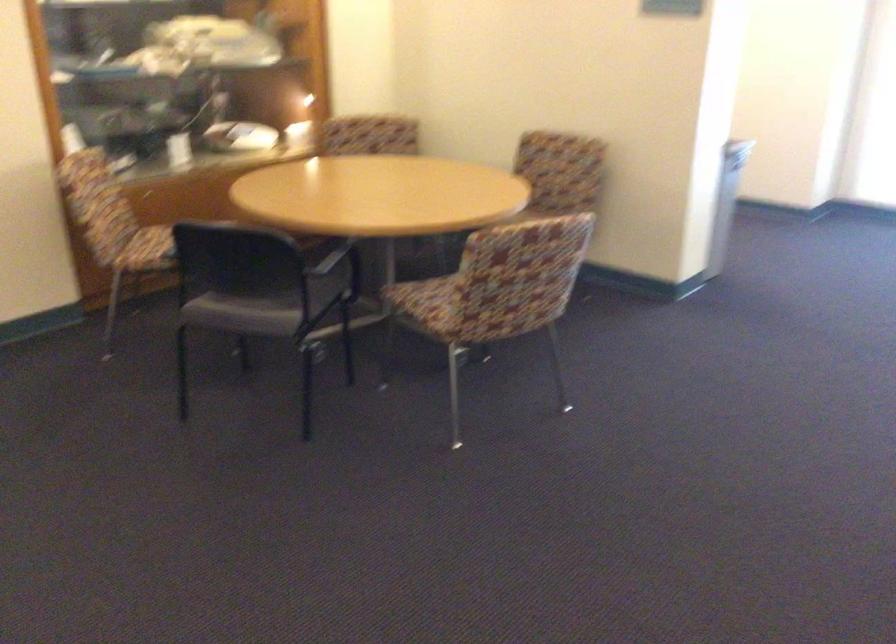
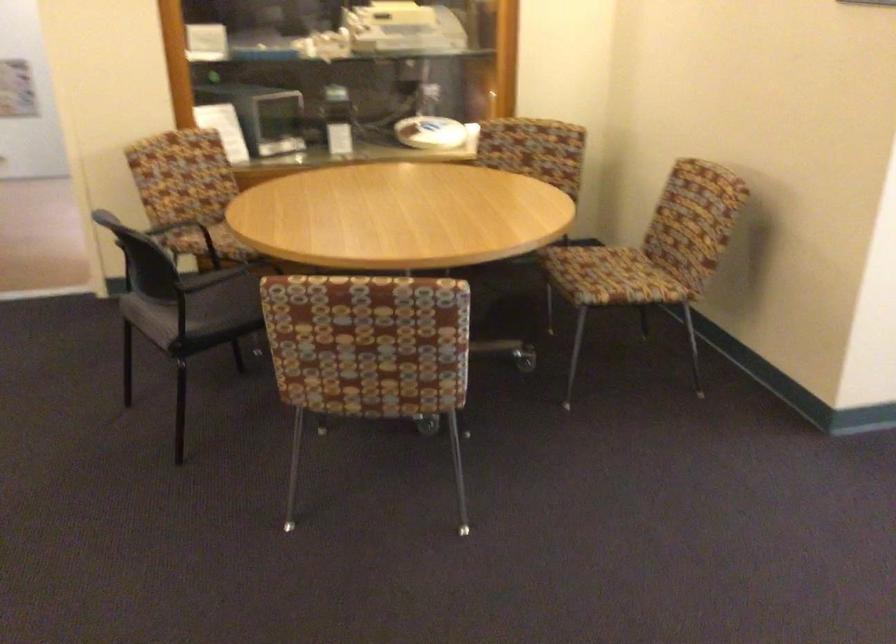
The point at (531, 198) is marked in the first image. Where is the corresponding point in the second image?

(652, 254)